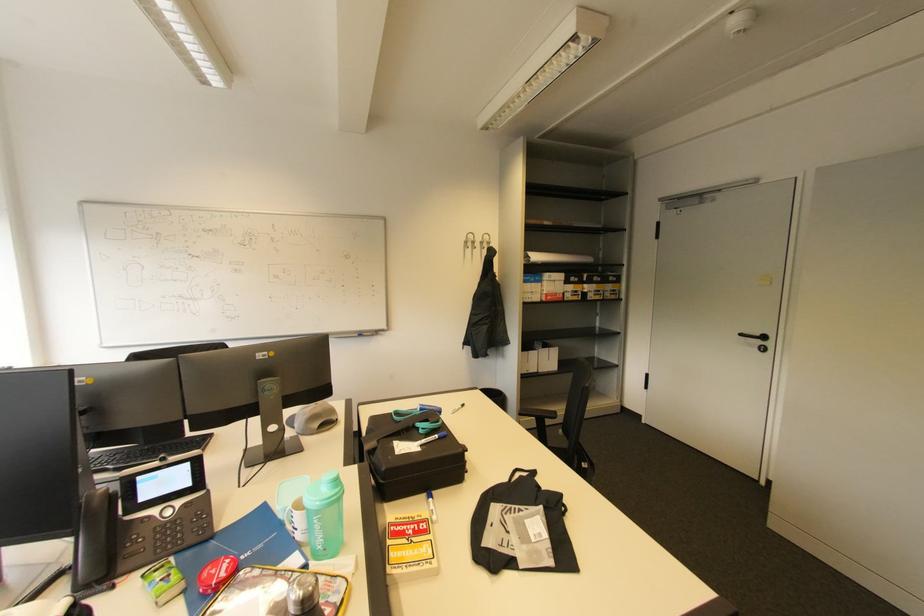
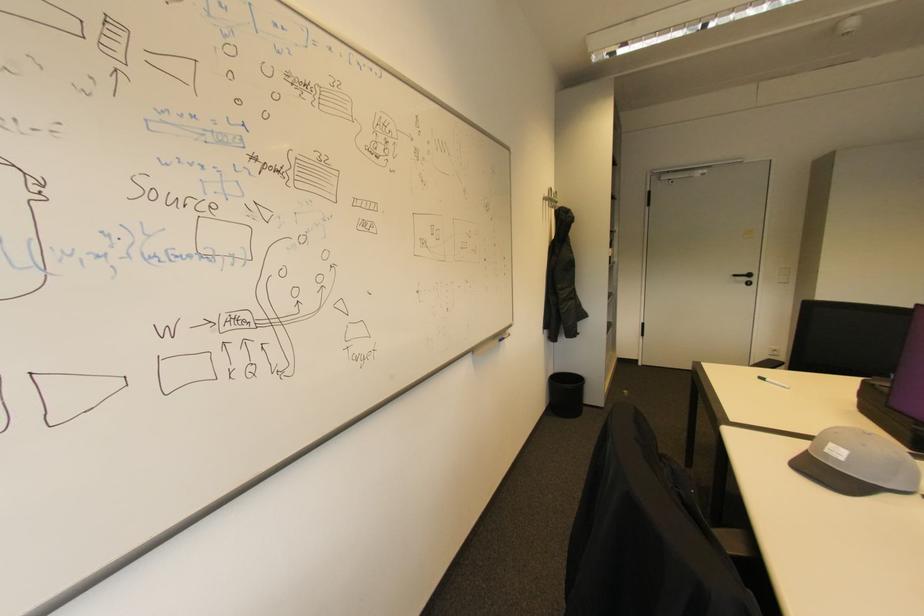
Find the pixel in the second image that matches point 769,339 in the first image.

(755, 276)